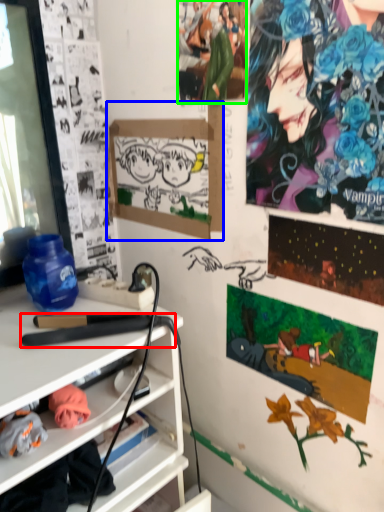
Question: Which object is the closest to the equipment (highlighted by a red box)? Choose among these: bulletin board (highlighted by a blue box) or person (highlighted by a green box).

Choices:
 (A) bulletin board
 (B) person

Answer: (A)